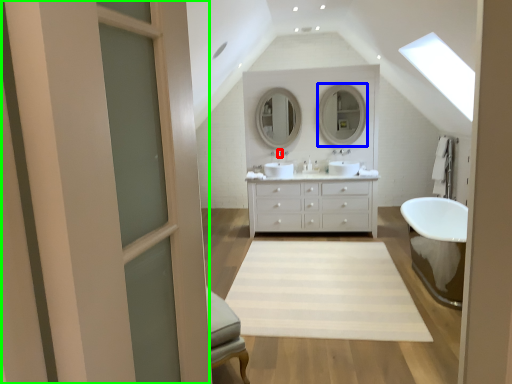
Question: Considering the real-world distances, which object is farthest from faucet (highlighted by a red box)? mirror (highlighted by a blue box) or screen door (highlighted by a green box)?

Choices:
 (A) mirror
 (B) screen door

Answer: (B)